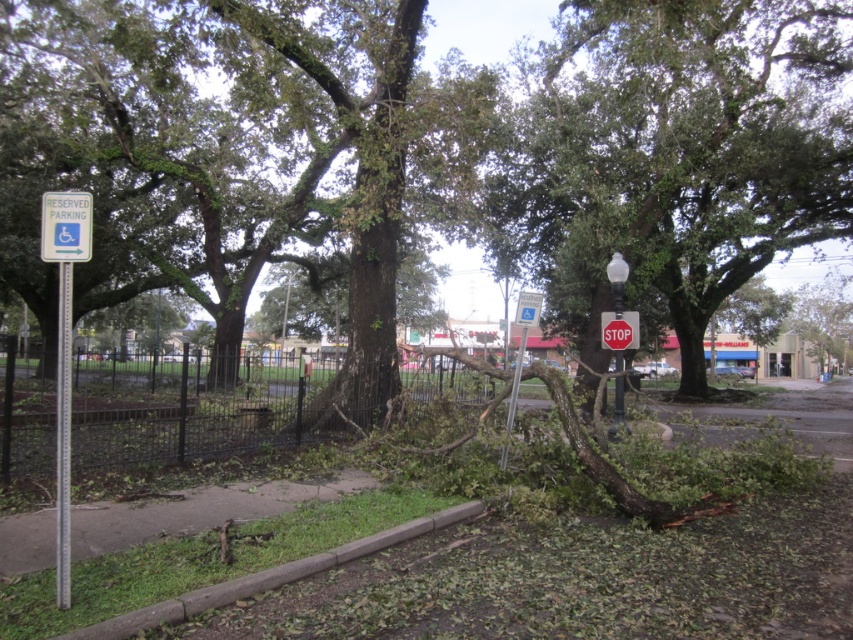
Who is higher up, metallic silver parking sign at center or metallic pole at center?

metallic silver parking sign at center is higher up.

Between metallic silver parking sign at center and metallic pole at center, which one has less height?

Standing shorter between the two is metallic pole at center.

Is point (519, 349) behind point (619, 420)?

Yes, point (519, 349) is farther from viewer.

The height and width of the screenshot is (640, 853). What are the coordinates of `metallic silver parking sign at center` in the screenshot? It's located at (519, 356).

Who is more forward, (724,273) or (68,381)?

Point (68,381) is more forward.

Who is positioned more to the left, green leafy tree at center or metallic silver pole at left?

metallic silver pole at left is more to the left.

Which is behind, point (636, 60) or point (67, 572)?

Point (636, 60)

This screenshot has width=853, height=640. I want to click on green leafy tree at center, so click(677, 150).

Who is positioned more to the left, metallic silver pole at left or metallic silver parking sign at center?

metallic silver pole at left is more to the left.

Who is more distant from viewer, [62,534] or [503,449]?

Point [503,449]

This screenshot has width=853, height=640. Find the location of `metallic silver pole at left`. metallic silver pole at left is located at coordinates (62, 436).